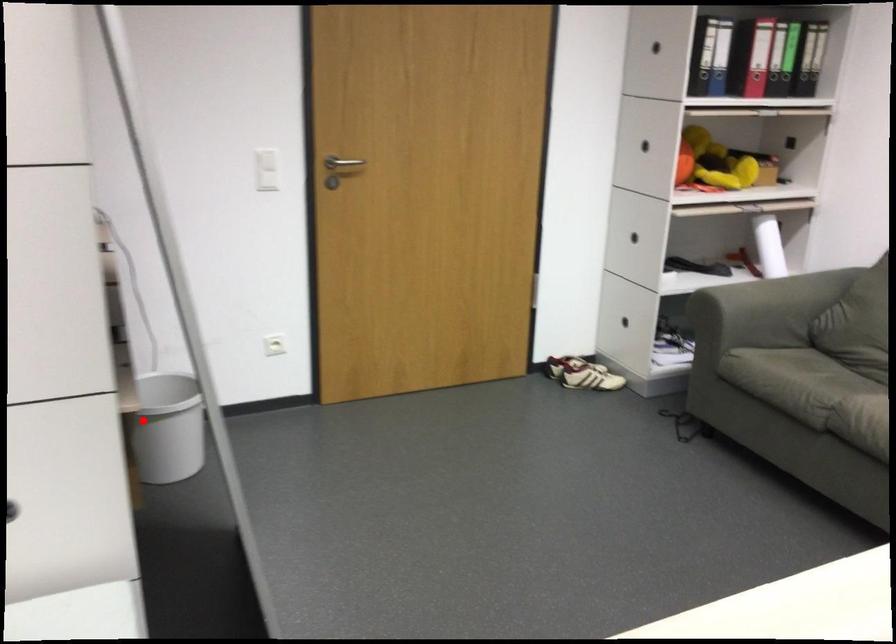
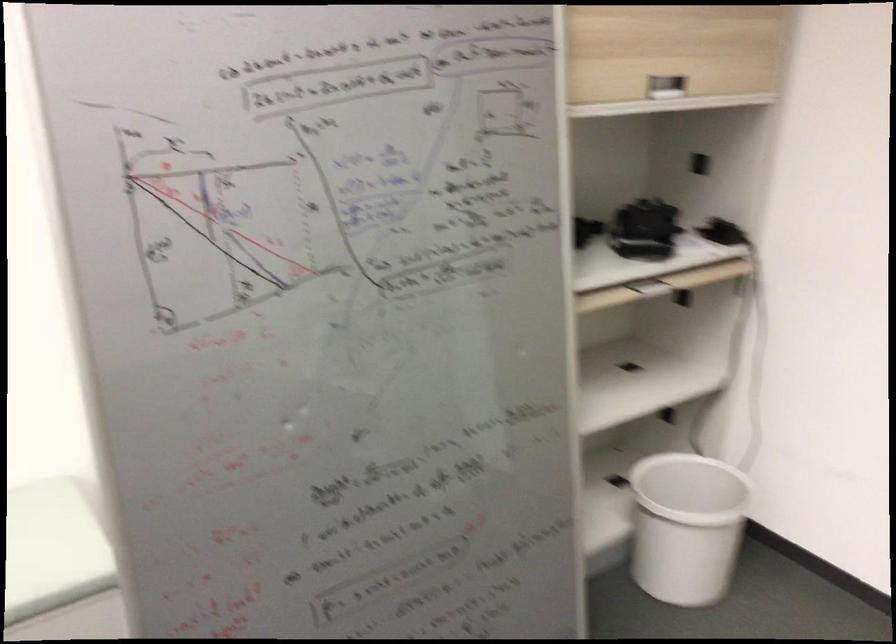
The point at the highlighted location is marked in the first image. Where is the corresponding point in the second image?

(686, 526)